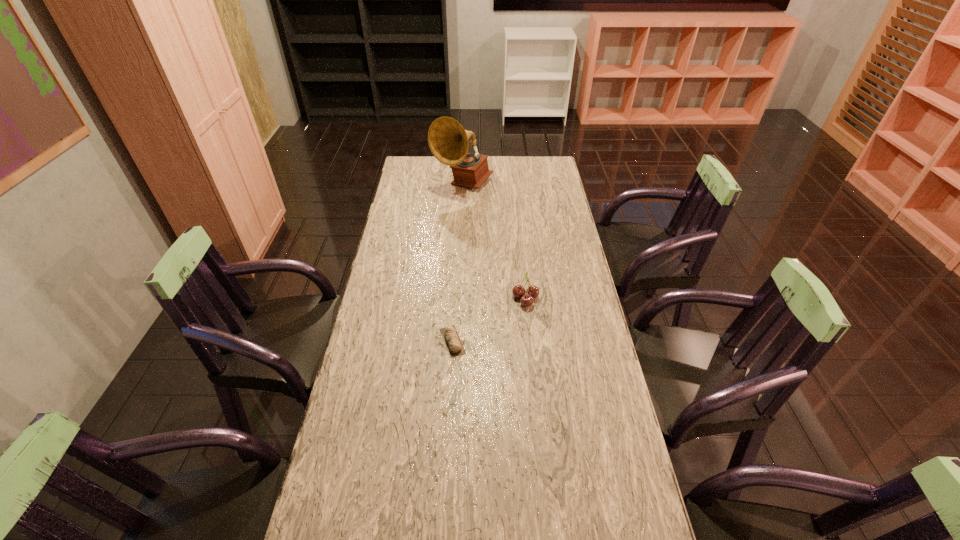
Image resolution: width=960 pixels, height=540 pixels. I want to click on free spot between the phonograph record and the cherry, so click(x=494, y=241).

Identify the location of vacant region between the tallest object and the cherry. The width and height of the screenshot is (960, 540). (494, 241).

Locate an element on the screen. Image resolution: width=960 pixels, height=540 pixels. free space that is in between the pita bread and the rightmost object is located at coordinates (489, 320).

Where is `vacant space that is in between the shortest object and the farthest object`? The height and width of the screenshot is (540, 960). vacant space that is in between the shortest object and the farthest object is located at coordinates (458, 263).

Find the location of a particular element. The height and width of the screenshot is (540, 960). vacant area that lies between the pita bread and the farthest object is located at coordinates (458, 263).

Locate an element on the screen. This screenshot has width=960, height=540. free area in between the nearest object and the cherry is located at coordinates (489, 320).

The image size is (960, 540). I want to click on blank region between the phonograph record and the rightmost object, so click(x=494, y=241).

Locate which object is the second closest to the pita bread. Please provide its 2D coordinates. Your answer should be formatted as a tuple, i.e. [(x, y)], where the tuple contains the x and y coordinates of a point satisfying the conditions above.

[(448, 141)]

Identify which object is the second nearest to the tallest object. Please provide its 2D coordinates. Your answer should be formatted as a tuple, i.e. [(x, y)], where the tuple contains the x and y coordinates of a point satisfying the conditions above.

[(450, 336)]

This screenshot has width=960, height=540. In order to click on blank space that satisfies the following two spatial constraints: 1. on the leaves of the rightmost object; 2. on the front side of the nearest object in this screenshot , I will do `click(530, 341)`.